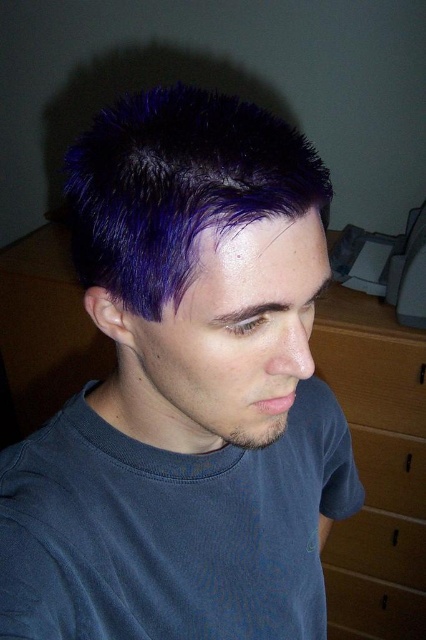
You are a photographer trying to capture a closeup of the purple spiky hair at upper center and the wooden drawer at lower right in the scene. Based on their sizes, which object should you prioritize focusing on first if you want to ensure both are in focus?

The purple spiky hair at upper center is smaller than the wooden drawer at lower right, so you should focus on the wooden drawer at lower right first to ensure both are in focus.

You are organizing a small party and need to place a 1.5 meter long tablecloth on the furniture in the scene. Which object between the brown wood dresser at right and the wooden drawer at lower right can the tablecloth be placed on without overhanging the edges?

The brown wood dresser at right is positioned on the right side of wooden drawer at lower right, but the exact dimensions of both objects are not provided. However, since the dresser is mentioned first and typically dressers are larger than individual drawers, it is likely the dresser can accommodate the tablecloth better. Please confirm the actual size before placing.